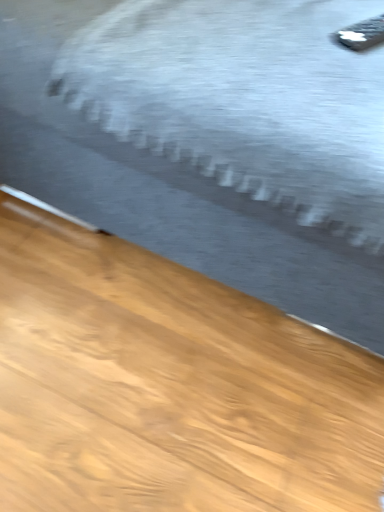
Question: Can you confirm if gray fabric bed at upper center is wider than black plastic remote at upper right?

Choices:
 (A) yes
 (B) no

Answer: (A)

Question: From a real-world perspective, does gray fabric bed at upper center stand above black plastic remote at upper right?

Choices:
 (A) yes
 (B) no

Answer: (B)

Question: From the image's perspective, is gray fabric bed at upper center located above black plastic remote at upper right?

Choices:
 (A) yes
 (B) no

Answer: (A)

Question: From a real-world perspective, is gray fabric bed at upper center located beneath black plastic remote at upper right?

Choices:
 (A) yes
 (B) no

Answer: (A)

Question: Considering the relative sizes of gray fabric bed at upper center and black plastic remote at upper right in the image provided, is gray fabric bed at upper center bigger than black plastic remote at upper right?

Choices:
 (A) yes
 (B) no

Answer: (A)

Question: Considering the relative sizes of gray fabric bed at upper center and black plastic remote at upper right in the image provided, is gray fabric bed at upper center taller than black plastic remote at upper right?

Choices:
 (A) no
 (B) yes

Answer: (B)

Question: Does black plastic remote at upper right appear on the right side of gray fabric bed at upper center?

Choices:
 (A) yes
 (B) no

Answer: (A)

Question: From the image's perspective, is black plastic remote at upper right above gray fabric bed at upper center?

Choices:
 (A) yes
 (B) no

Answer: (B)

Question: From a real-world perspective, is black plastic remote at upper right on top of gray fabric bed at upper center?

Choices:
 (A) yes
 (B) no

Answer: (A)

Question: Is black plastic remote at upper right to the left of gray fabric bed at upper center from the viewer's perspective?

Choices:
 (A) yes
 (B) no

Answer: (B)

Question: Does black plastic remote at upper right have a lesser height compared to gray fabric bed at upper center?

Choices:
 (A) yes
 (B) no

Answer: (A)

Question: Considering the relative sizes of black plastic remote at upper right and gray fabric bed at upper center in the image provided, is black plastic remote at upper right taller than gray fabric bed at upper center?

Choices:
 (A) no
 (B) yes

Answer: (A)

Question: Considering their positions, is black plastic remote at upper right located in front of or behind gray fabric bed at upper center?

Choices:
 (A) behind
 (B) front

Answer: (A)